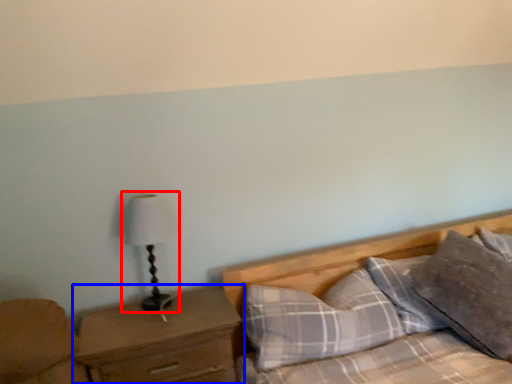
Question: Among these objects, which one is nearest to the camera, table lamp (highlighted by a red box) or nightstand (highlighted by a blue box)?

Choices:
 (A) table lamp
 (B) nightstand

Answer: (B)